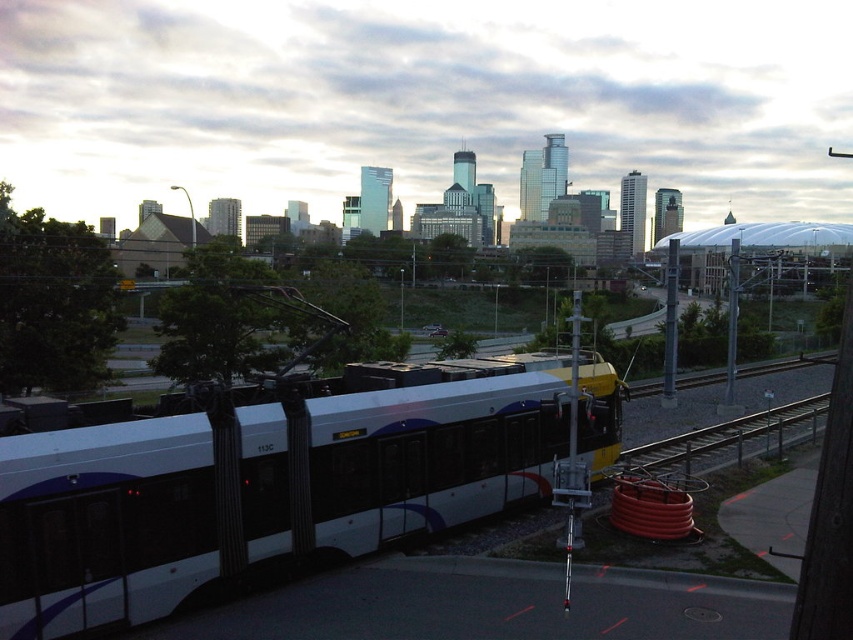
Can you confirm if white glossy passenger train at center is bigger than metallic gray train track at lower right?

Indeed, white glossy passenger train at center has a larger size compared to metallic gray train track at lower right.

Does white glossy passenger train at center have a lesser height compared to metallic gray train track at lower right?

Incorrect, white glossy passenger train at center's height does not fall short of metallic gray train track at lower right's.

Does point (6, 445) lie behind point (704, 449)?

That is False.

The height and width of the screenshot is (640, 853). In order to click on white glossy passenger train at center in this screenshot , I will do `click(276, 477)`.